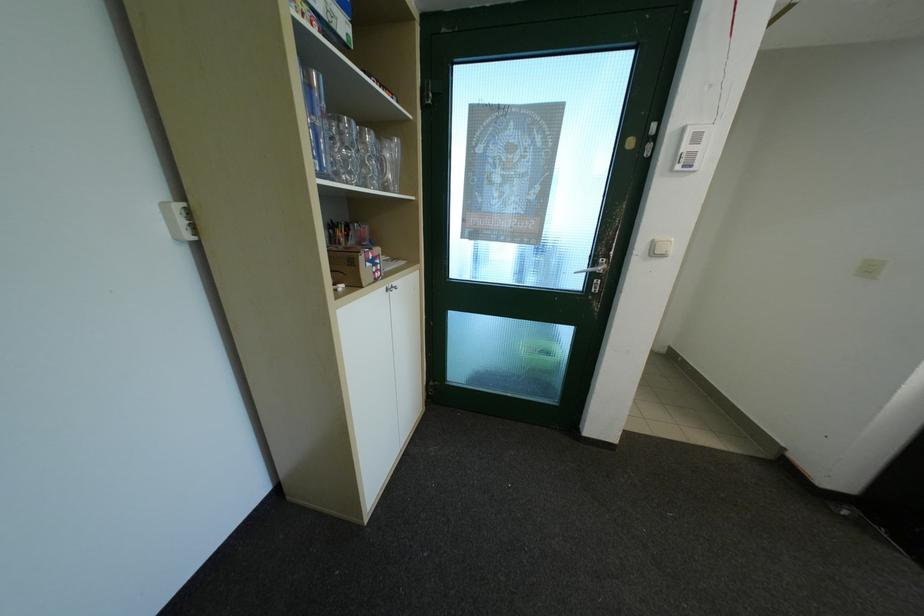
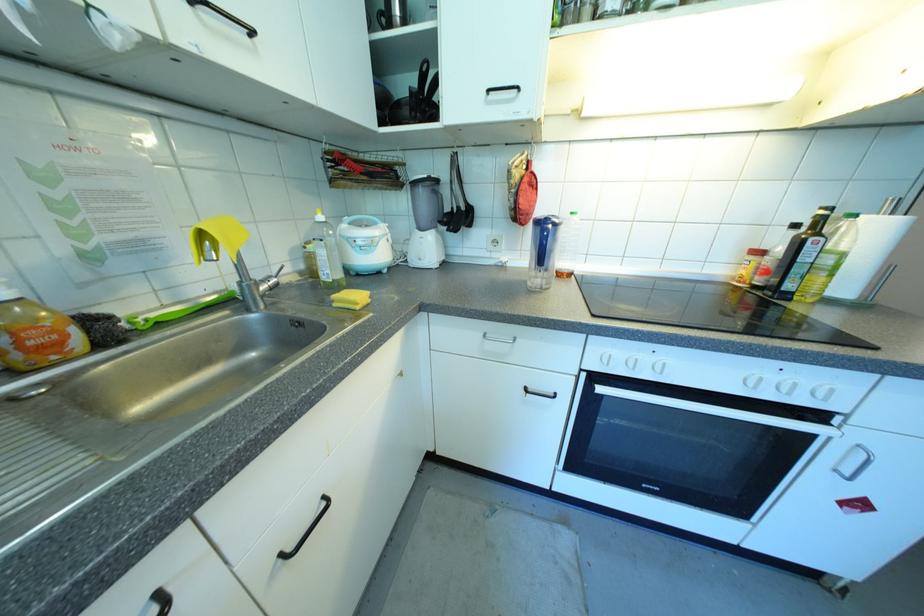
In a continuous first-person perspective shot, in which direction is the camera moving?

The movement direction of the cameraman is left, backward.